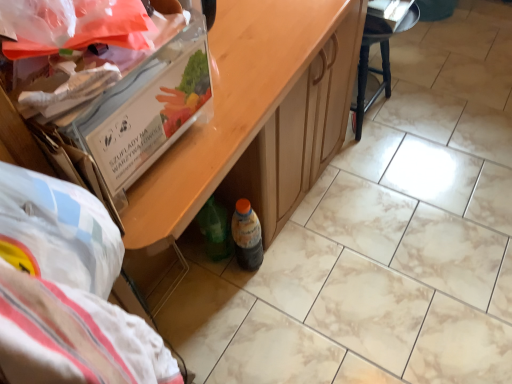
From the picture: Measure the distance between wooden table at center and camera.

wooden table at center is 55.08 centimeters away from camera.

Locate an element on the screen. This screenshot has height=384, width=512. wooden table at center is located at coordinates (252, 119).

Based on their positions, is black wood stool at upper right located to the left or right of translucent plastic bottle at lower center?

Based on their positions, black wood stool at upper right is located to the right of translucent plastic bottle at lower center.

Does black wood stool at upper right have a greater height compared to translucent plastic bottle at lower center?

Yes.

From a real-world perspective, is translucent plastic bottle at lower center below black wood stool at upper right?

Yes, from a real-world perspective, translucent plastic bottle at lower center is beneath black wood stool at upper right.

Is point (244, 239) less distant than point (403, 18)?

Yes.

Is translucent plastic bottle at lower center aimed at black wood stool at upper right?

No, translucent plastic bottle at lower center does not turn towards black wood stool at upper right.

Considering the sizes of translucent plastic bottle at lower center and black wood stool at upper right in the image, is translucent plastic bottle at lower center taller or shorter than black wood stool at upper right?

In the image, translucent plastic bottle at lower center appears to be shorter than black wood stool at upper right.

Find the location of a particular element. table below the black wood stool at upper right (from the image's perspective) is located at coordinates (252, 119).

Does wooden table at center have a smaller size compared to black wood stool at upper right?

Actually, wooden table at center might be larger than black wood stool at upper right.

Between wooden table at center and black wood stool at upper right, which one has more height?

wooden table at center is taller.

Considering the points (313, 139) and (368, 5), which point is in front, point (313, 139) or point (368, 5)?

The point (313, 139) is more forward.

From a real-world perspective, is wooden table at center above or below translucent plastic bottle at lower center?

In terms of real-world spatial position, wooden table at center is above translucent plastic bottle at lower center.

Which is behind, wooden table at center or translucent plastic bottle at lower center?

translucent plastic bottle at lower center is further from the camera.

At what (x,y) coordinates should I click in order to perform the action: click on table above the translucent plastic bottle at lower center (from a real-world perspective). Please return your answer as a coordinate pair (x, y). The height and width of the screenshot is (384, 512). Looking at the image, I should click on (252, 119).

From a real-world perspective, relative to wooden table at center, is black wood stool at upper right vertically above or below?

black wood stool at upper right is situated lower than wooden table at center in the real world.

Is black wood stool at upper right positioned far away from wooden table at center?

No, there isn't a large distance between black wood stool at upper right and wooden table at center.

This screenshot has height=384, width=512. I want to click on table located in front of the translucent plastic bottle at lower center, so click(252, 119).

Which point is more distant from viewer, [244,268] or [237,118]?

The point [244,268] is farther.

Is translucent plastic bottle at lower center positioned with its back to wooden table at center?

Correct, translucent plastic bottle at lower center is looking away from wooden table at center.

Looking at this image, from the image's perspective, is translucent plastic bottle at lower center located beneath wooden table at center?

Yes.

This screenshot has height=384, width=512. In order to click on bottle below the black wood stool at upper right (from a real-world perspective) in this screenshot , I will do `click(247, 236)`.

Image resolution: width=512 pixels, height=384 pixels. I want to click on furniture behind the translucent plastic bottle at lower center, so click(380, 49).

From the image, which object appears to be farther from black wood stool at upper right, wooden table at center or translucent plastic bottle at lower center?

Based on the image, translucent plastic bottle at lower center appears to be further to black wood stool at upper right.

When comparing their distances from wooden table at center, does black wood stool at upper right or translucent plastic bottle at lower center seem closer?

translucent plastic bottle at lower center lies closer to wooden table at center than the other object.

Based on their spatial positions, is translucent plastic bottle at lower center or wooden table at center further from black wood stool at upper right?

translucent plastic bottle at lower center lies further to black wood stool at upper right than the other object.

Looking at the image, which one is located further to translucent plastic bottle at lower center, wooden table at center or black wood stool at upper right?

Based on the image, black wood stool at upper right appears to be further to translucent plastic bottle at lower center.

From the image, which object appears to be farther from translucent plastic bottle at lower center, black wood stool at upper right or wooden table at center?

black wood stool at upper right is further to translucent plastic bottle at lower center.

From the image, which object appears to be nearer to wooden table at center, translucent plastic bottle at lower center or black wood stool at upper right?

translucent plastic bottle at lower center lies closer to wooden table at center than the other object.

This screenshot has height=384, width=512. What are the coordinates of `bottle between wooden table at center and black wood stool at upper right from front to back` in the screenshot? It's located at (247, 236).